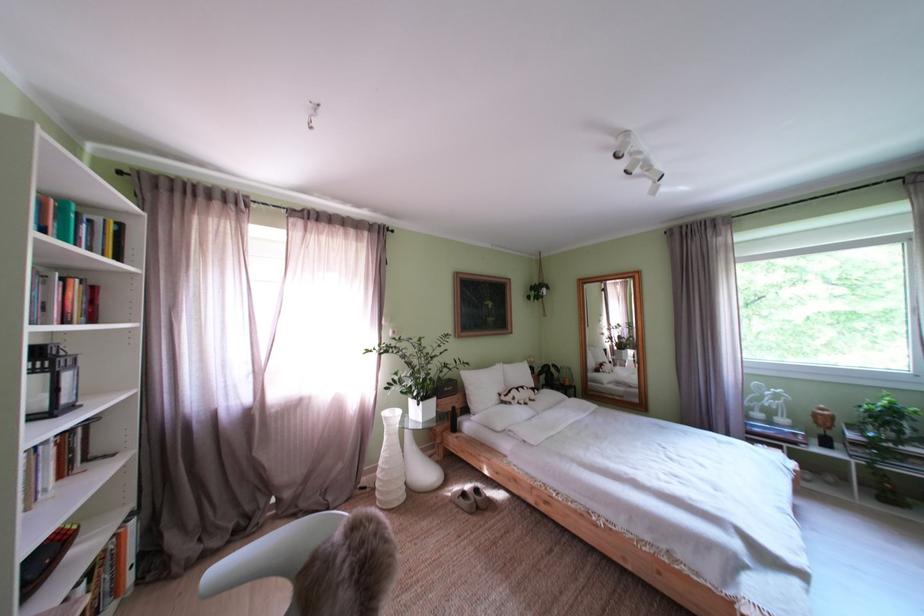
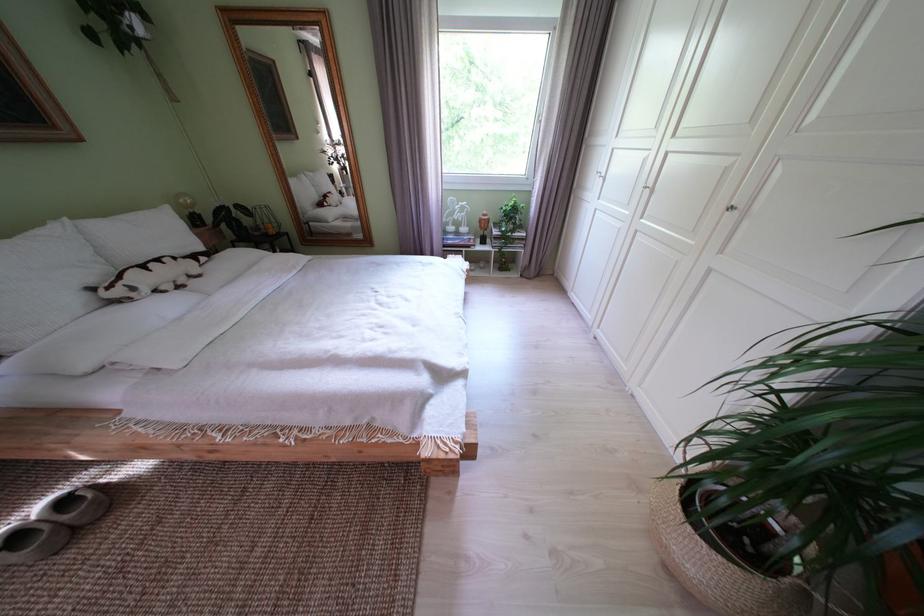
The point at (525, 405) is marked in the first image. Where is the corresponding point in the second image?

(146, 294)